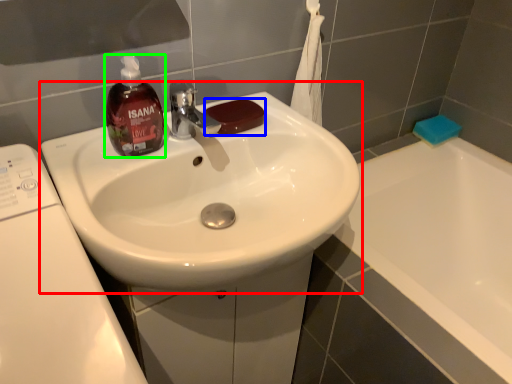
Question: Considering the real-world distances, which object is closest to sink (highlighted by a red box)? soap (highlighted by a blue box) or bottle (highlighted by a green box).

Choices:
 (A) soap
 (B) bottle

Answer: (B)